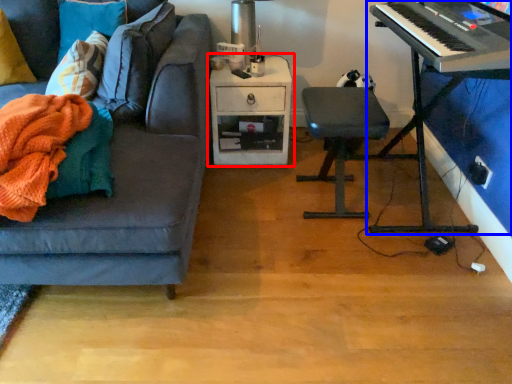
Question: Which object is closer to the camera taking this photo, table (highlighted by a red box) or piano (highlighted by a blue box)?

Choices:
 (A) table
 (B) piano

Answer: (B)